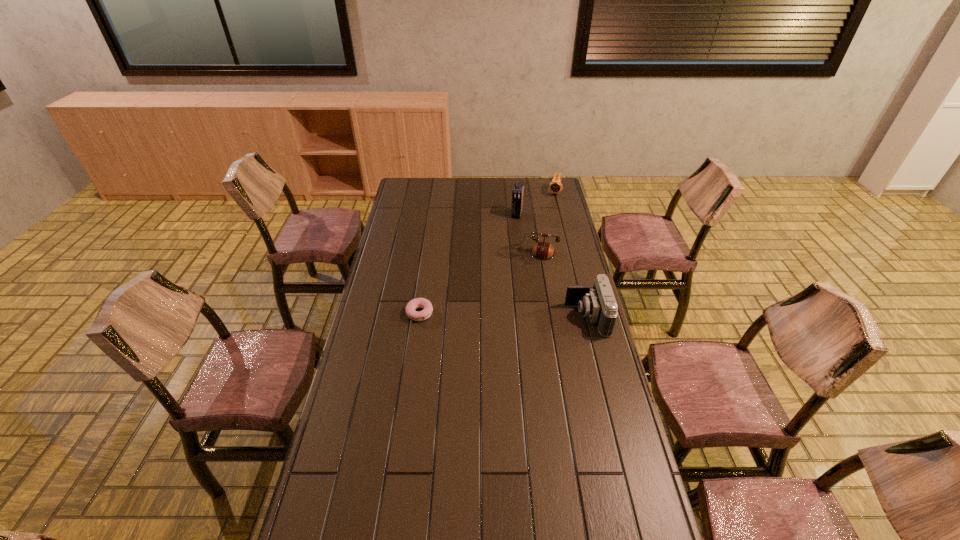
Find the location of `doughnut`. doughnut is located at coordinates pyautogui.click(x=412, y=305).

This screenshot has height=540, width=960. What are the coordinates of `the leftmost object` in the screenshot? It's located at (412, 305).

You are a GUI agent. You are given a task and a screenshot of the screen. Output one action in this format:
    pyautogui.click(x=<x>, y=<y>)
    Task: Click on the camera
    The width and height of the screenshot is (960, 540).
    Given the screenshot: What is the action you would take?
    pyautogui.click(x=597, y=302)

This screenshot has height=540, width=960. I want to click on watch, so click(x=555, y=186).

At what (x,y) coordinates should I click in order to perform the action: click on telephone. Please return your answer as a coordinate pair (x, y). The image size is (960, 540). Looking at the image, I should click on [542, 250].

Where is `the tallest object`? The width and height of the screenshot is (960, 540). the tallest object is located at coordinates pyautogui.click(x=517, y=193).

What are the coordinates of `the fourth nearest object` in the screenshot? It's located at (517, 193).

Identify the location of free space located 0.210m on the right of the shortest object. (487, 313).

You are a GUI agent. You are given a task and a screenshot of the screen. Output one action in this format:
    pyautogui.click(x=<x>, y=<y>)
    Task: Click on the free region located at the front of the fourth shortest object with an open lens cover
    
    Given the screenshot: What is the action you would take?
    pyautogui.click(x=497, y=317)

At what (x,y) coordinates should I click in order to perform the action: click on blank space located 0.400m at the front of the fourth shortest object with an open lens cover. Please return your answer as a coordinate pair (x, y). The image size is (960, 540). Looking at the image, I should click on (464, 317).